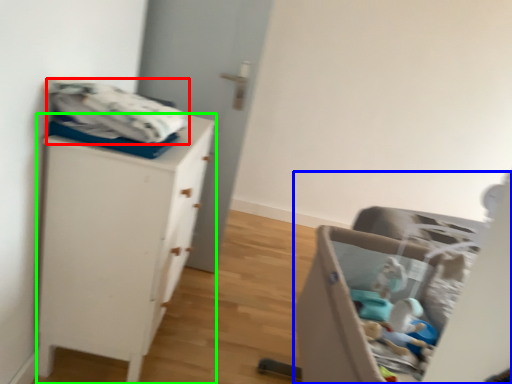
Question: Considering the real-world distances, which object is closest to baby clothe (highlighted by a red box)? furniture (highlighted by a blue box) or chest of drawers (highlighted by a green box).

Choices:
 (A) furniture
 (B) chest of drawers

Answer: (B)